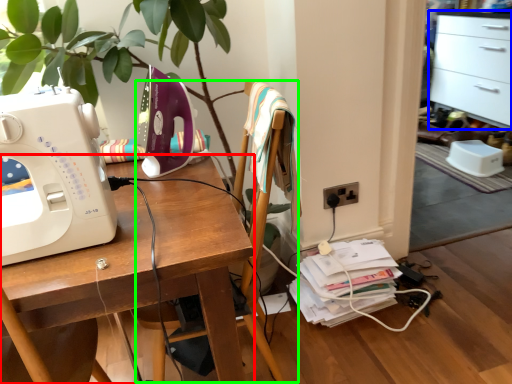
Question: Based on their relative distances, which object is farther from desk (highlighted by a red box)? Choose from file cabinet (highlighted by a blue box) and chair (highlighted by a green box).

Choices:
 (A) file cabinet
 (B) chair

Answer: (A)